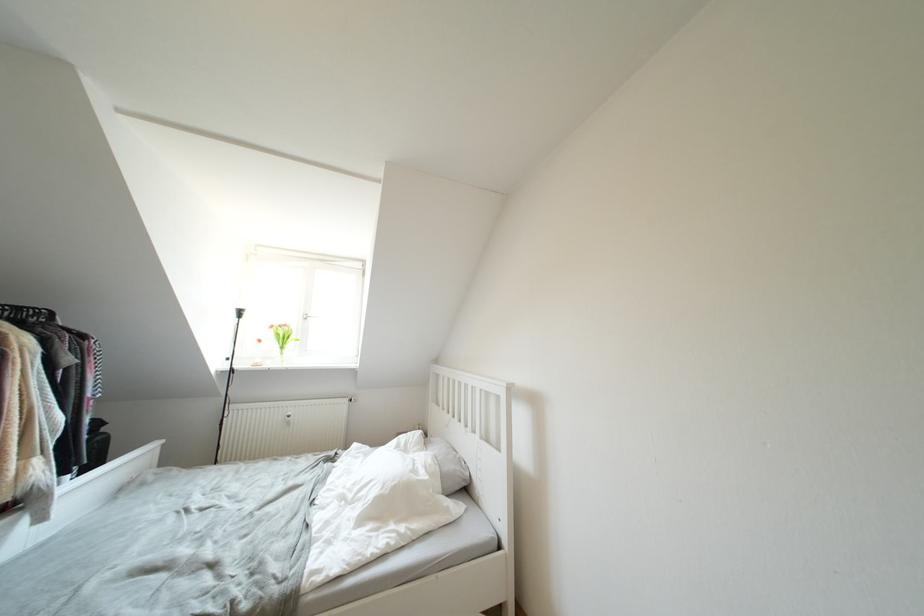
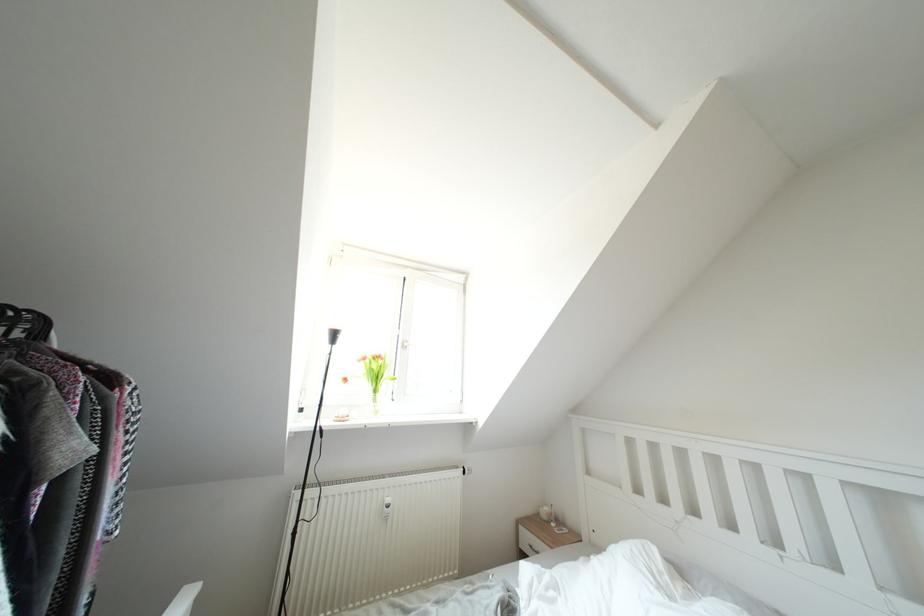
The point at (276, 331) is marked in the first image. Where is the corresponding point in the second image?

(370, 363)